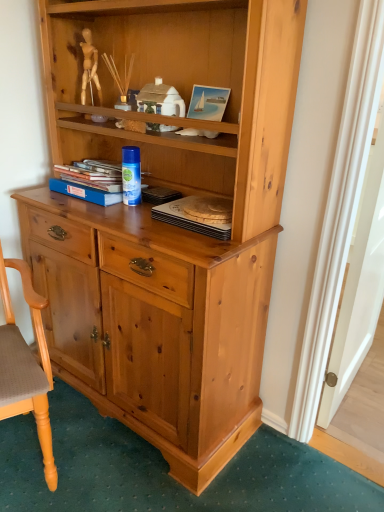
The image size is (384, 512). I want to click on free point below wooden polished chair at lower left (from a real-world perspective), so click(36, 472).